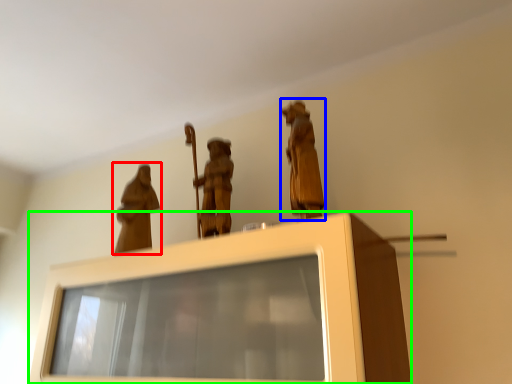
Question: Estimate the real-world distances between objects in this image. Which object is farther from person (highlighted by a red box), person (highlighted by a blue box) or furniture (highlighted by a green box)?

Choices:
 (A) person
 (B) furniture

Answer: (A)